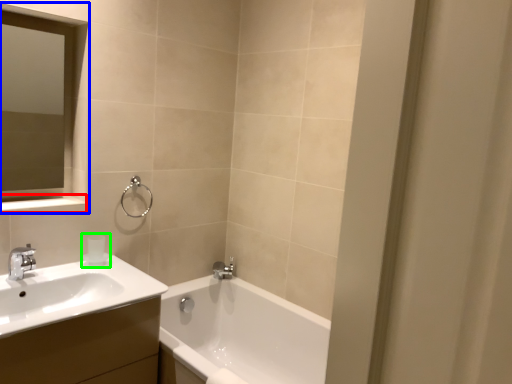
Question: Estimate the real-world distances between objects in this image. Which object is farther from balustrade (highlighted by a red box), medicine cabinet (highlighted by a blue box) or toiletry (highlighted by a green box)?

Choices:
 (A) medicine cabinet
 (B) toiletry

Answer: (B)